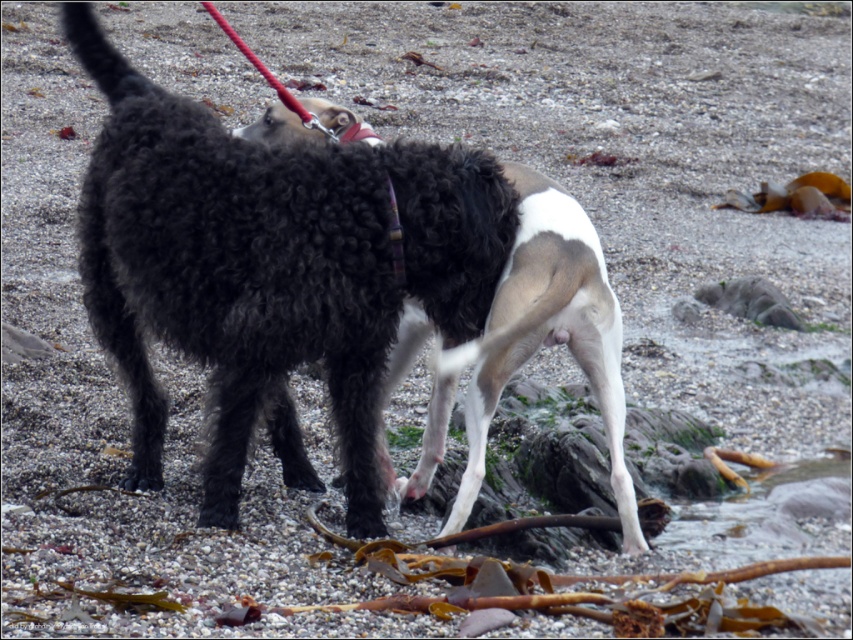
Question: Which point is closer to the camera?

Choices:
 (A) (585, 266)
 (B) (355, 129)

Answer: (A)

Question: Is curly black fur at center in front of plaid fabric neckband at center?

Choices:
 (A) yes
 (B) no

Answer: (A)

Question: Does curly black fur at center appear over plaid fabric neckband at center?

Choices:
 (A) yes
 (B) no

Answer: (B)

Question: From the image, what is the correct spatial relationship of curly black fur at center in relation to plaid fabric neckband at center?

Choices:
 (A) right
 (B) left

Answer: (A)

Question: Which of the following is the closest to the observer?

Choices:
 (A) curly black fur at center
 (B) plaid fabric neckband at center

Answer: (A)

Question: Which point appears farthest from the camera in this image?

Choices:
 (A) (494, 376)
 (B) (351, 132)

Answer: (B)